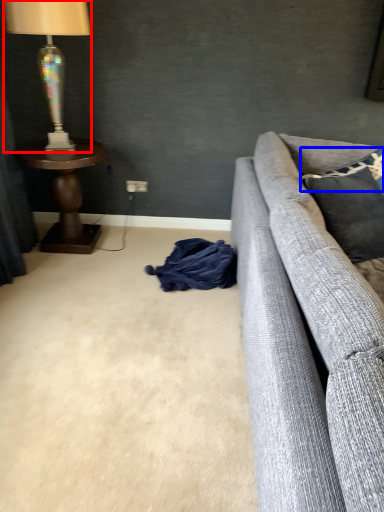
Question: Which point is closer to the camera, lamp (highlighted by a red box) or pillow (highlighted by a blue box)?

Choices:
 (A) lamp
 (B) pillow

Answer: (A)